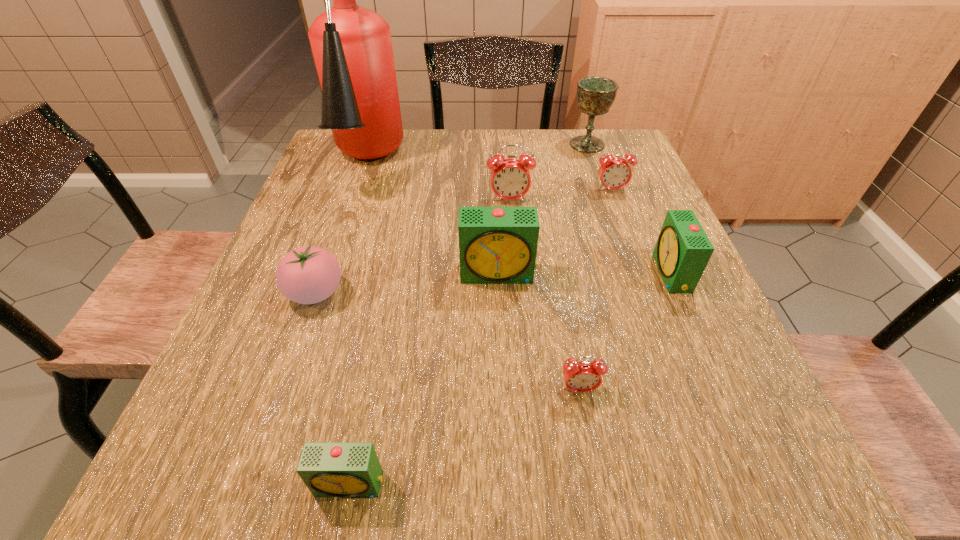
This screenshot has height=540, width=960. I want to click on the tallest object, so click(x=352, y=48).

The height and width of the screenshot is (540, 960). I want to click on red fire extinguisher, so click(352, 48).

This screenshot has height=540, width=960. Find the location of `chalice`. chalice is located at coordinates (595, 95).

Locate an element on the screen. This screenshot has width=960, height=540. the biggest red alarm clock is located at coordinates (510, 178).

Locate an element on the screen. The image size is (960, 540). the second nearest red alarm clock is located at coordinates (510, 178).

Locate an element on the screen. The width and height of the screenshot is (960, 540). the second green alarm clock from right to left is located at coordinates (497, 245).

Locate an element on the screen. the rightmost red alarm clock is located at coordinates (614, 173).

Find the location of a particular element. This screenshot has width=960, height=540. the farthest alarm clock is located at coordinates tap(614, 173).

Find the location of a particular element. the second smallest green alarm clock is located at coordinates (683, 250).

Where is `red tomato`? The width and height of the screenshot is (960, 540). red tomato is located at coordinates (307, 275).